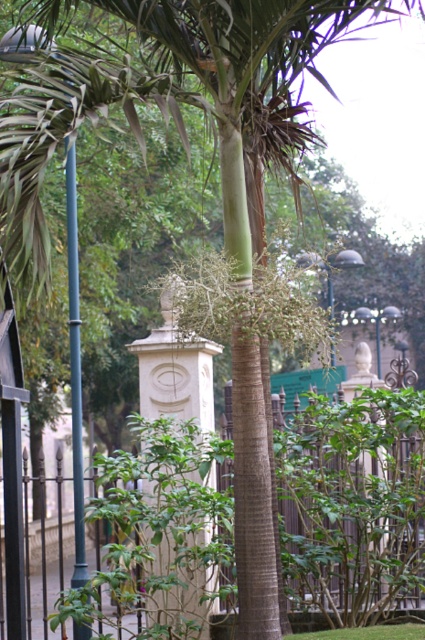
At what (x,y) coordinates should I click in order to perform the action: click on black metal fence at center. Please return your answer as a coordinate pair (x, y). This screenshot has width=425, height=640. Looking at the image, I should click on coord(354,504).

Is black metal fence at center taller than metallic pole at left?

Yes.

Locate an element on the screen. black metal fence at center is located at coordinates (354, 504).

Locate an element on the screen. This screenshot has height=640, width=425. black metal fence at center is located at coordinates (354, 504).